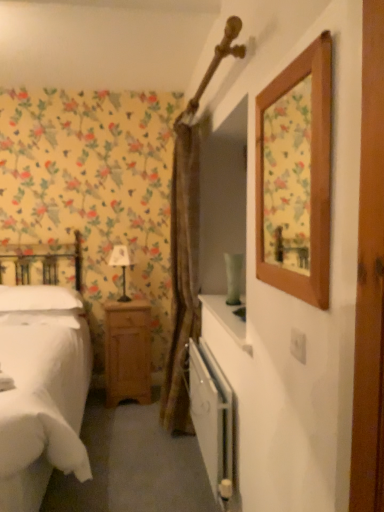
You are a GUI agent. You are given a task and a screenshot of the screen. Output one action in this format:
    pyautogui.click(x=<x>, y=<y>)
    Task: Click on the free space in front of brown textured curtain at center
    
    Given the screenshot: What is the action you would take?
    coord(152,489)